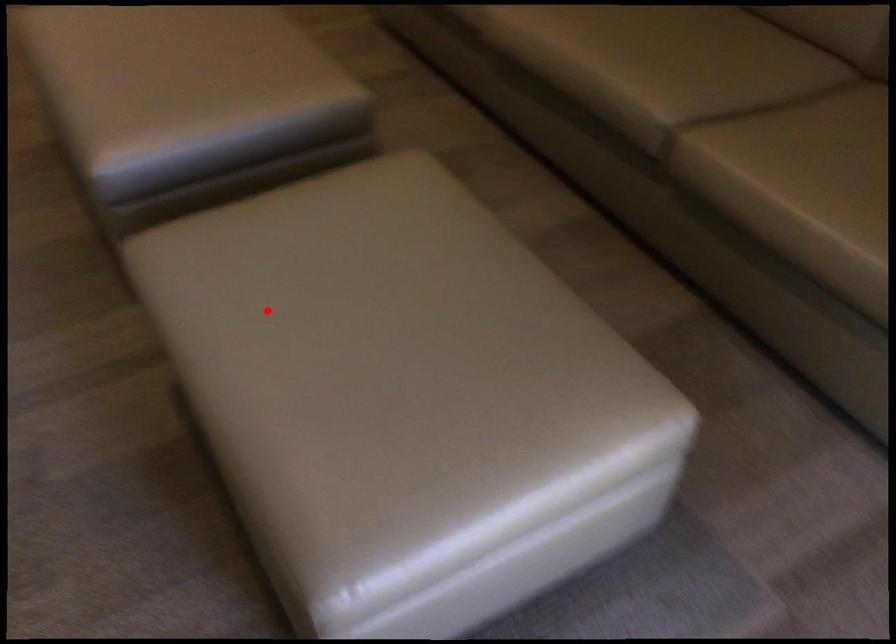
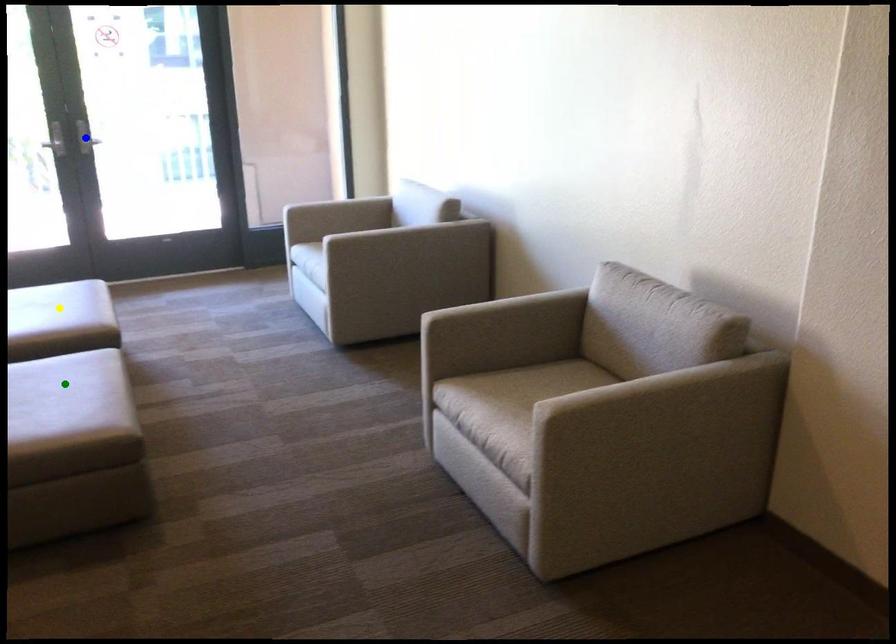
Question: I am providing you with two images of the same scene from different viewpoints. A red point is marked on the first image. You are given multiple points on the second image. Which point in image 2 is actually the same real-world point as the red point in image 1?

Choices:
 (A) yellow point
 (B) green point
 (C) blue point

Answer: (A)